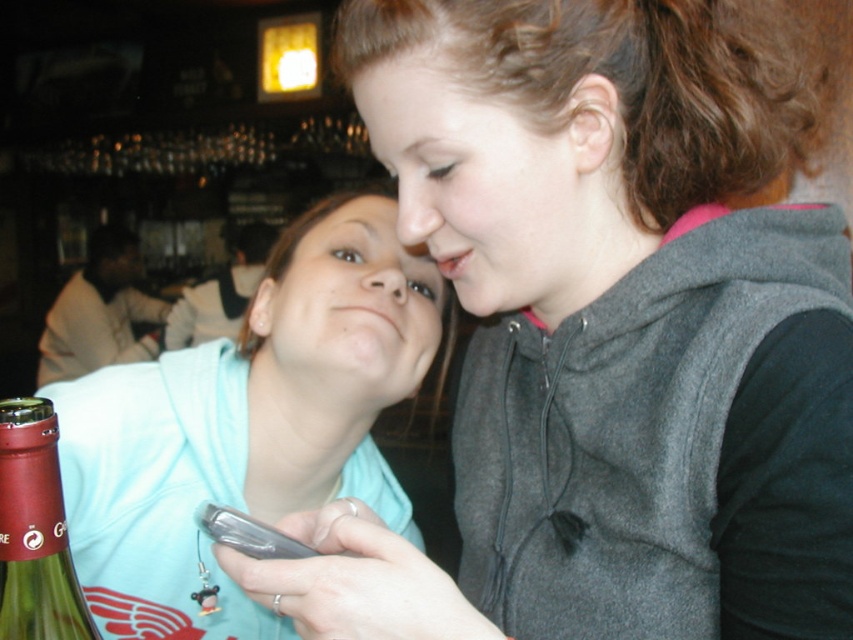
Looking at this image, you are a delivery person who needs to pack the light blue hoodie at center and the green glass bottle at lower left into a box. The box can only hold items where the largest item is no more than twice the size of the smallest. Can you fit both items into the box?

The light blue hoodie at center is bigger than the green glass bottle at lower left. Since the largest item is the light blue hoodie at center and the smallest is the green glass bottle at lower left, we need to check if the hoodie is no more than twice the size of the bottle. However, the exact sizes aren not provided, so we cannot determine if they fit within the box requirement.